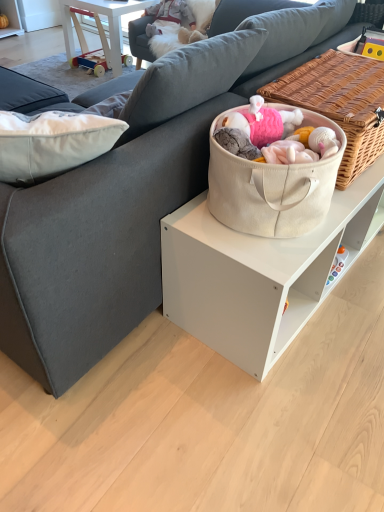
Question: Considering the positions of point (304, 74) and point (92, 11), is point (304, 74) closer or farther from the camera than point (92, 11)?

Choices:
 (A) farther
 (B) closer

Answer: (B)

Question: Is beige canvas tote at center in front of or behind wooden toy at upper left in the image?

Choices:
 (A) front
 (B) behind

Answer: (A)

Question: In terms of height, does beige canvas tote at center look taller or shorter compared to wooden toy at upper left?

Choices:
 (A) tall
 (B) short

Answer: (B)

Question: From the image's perspective, is wooden toy at upper left above or below beige canvas tote at center?

Choices:
 (A) below
 (B) above

Answer: (B)

Question: In terms of width, does wooden toy at upper left look wider or thinner when compared to beige canvas tote at center?

Choices:
 (A) wide
 (B) thin

Answer: (A)

Question: Would you say wooden toy at upper left is inside or outside beige canvas tote at center?

Choices:
 (A) outside
 (B) inside

Answer: (A)

Question: Is wooden toy at upper left bigger or smaller than beige canvas tote at center?

Choices:
 (A) big
 (B) small

Answer: (A)